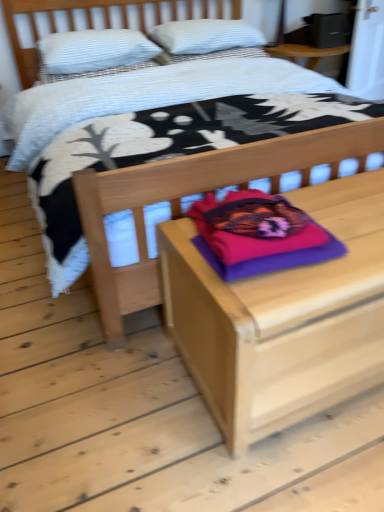
Question: Is purple soft pillow at center, which ranks as the third pillow in top-to-bottom order, taller than wooden nightstand at center?

Choices:
 (A) yes
 (B) no

Answer: (B)

Question: Is purple soft pillow at center, the 3th pillow in the back-to-front sequence, shorter than wooden nightstand at center?

Choices:
 (A) no
 (B) yes

Answer: (B)

Question: Can you confirm if purple soft pillow at center, the 3th pillow in the back-to-front sequence, is thinner than wooden nightstand at center?

Choices:
 (A) no
 (B) yes

Answer: (B)

Question: Is purple soft pillow at center, the 3th pillow in the back-to-front sequence, positioned behind wooden nightstand at center?

Choices:
 (A) no
 (B) yes

Answer: (B)

Question: Is purple soft pillow at center, the first pillow viewed from the front, to the right of wooden nightstand at center from the viewer's perspective?

Choices:
 (A) no
 (B) yes

Answer: (A)

Question: From the image's perspective, is purple soft pillow at center, which ranks as the third pillow in top-to-bottom order, above or below white textured pillow at upper left, acting as the 2th pillow starting from the back?

Choices:
 (A) below
 (B) above

Answer: (A)

Question: Is purple soft pillow at center, which ranks as the 1th pillow in bottom-to-top order, taller or shorter than white textured pillow at upper left, the second pillow in the bottom-to-top sequence?

Choices:
 (A) short
 (B) tall

Answer: (A)

Question: Considering the positions of point (238, 198) and point (142, 39), is point (238, 198) closer or farther from the camera than point (142, 39)?

Choices:
 (A) farther
 (B) closer

Answer: (B)

Question: Would you say purple soft pillow at center, which ranks as the 1th pillow in bottom-to-top order, is inside or outside white textured pillow at upper left, which is the second pillow from top to bottom?

Choices:
 (A) outside
 (B) inside

Answer: (A)

Question: From their relative heights in the image, would you say purple soft pillow at center, which ranks as the third pillow in top-to-bottom order, is taller or shorter than wooden bed at center?

Choices:
 (A) short
 (B) tall

Answer: (A)

Question: Is purple soft pillow at center, which ranks as the third pillow in top-to-bottom order, wider or thinner than wooden bed at center?

Choices:
 (A) wide
 (B) thin

Answer: (B)

Question: In the image, is purple soft pillow at center, the 3th pillow in the back-to-front sequence, positioned in front of or behind wooden bed at center?

Choices:
 (A) front
 (B) behind

Answer: (B)

Question: Is point (276, 208) closer or farther from the camera than point (21, 74)?

Choices:
 (A) farther
 (B) closer

Answer: (B)

Question: Considering the positions of wooden nightstand at center and white textured pillow at upper left, the second pillow in the bottom-to-top sequence, in the image, is wooden nightstand at center wider or thinner than white textured pillow at upper left, the second pillow in the bottom-to-top sequence,?

Choices:
 (A) thin
 (B) wide

Answer: (B)

Question: Considering the positions of wooden nightstand at center and white textured pillow at upper left, the second pillow viewed from the front, in the image, is wooden nightstand at center taller or shorter than white textured pillow at upper left, the second pillow viewed from the front,?

Choices:
 (A) short
 (B) tall

Answer: (B)